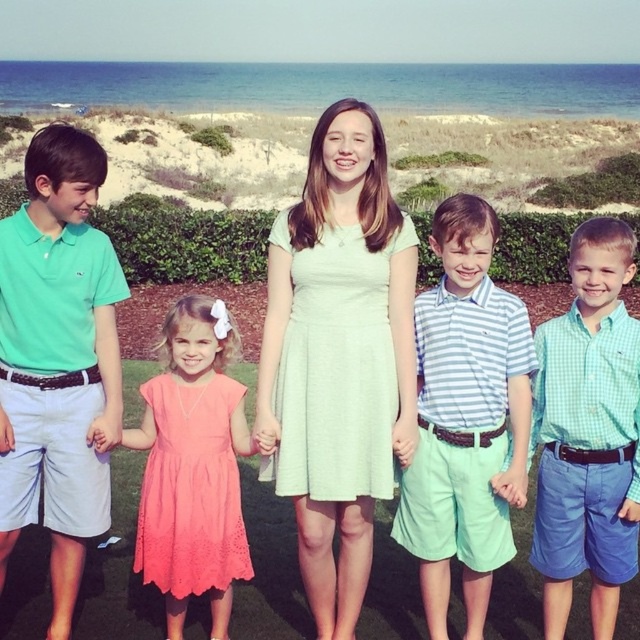
Consider the image. You are a photographer trying to capture a photo of the children holding hands in a line. You notice the green checkered shirt at center and the coral lace dress at center. Which child should you focus on to ensure the other is fully visible in the background?

The photographer should focus on the green checkered shirt at center, as it is in front of the coral lace dress at center, allowing the coral lace dress at center to be visible in the background.

You are a photographer trying to capture a photo of the two central children in the group. The light green dress at center and the striped cotton shirt at center are standing close to each other. Which of the two is taller?

The light green dress at center is taller than the striped cotton shirt at center.

Consider the image. You are a photographer trying to capture the children in the center of the image. You notice the light green dress at center and the green checkered shirt at center. Which one should you focus on if you want to photograph the child who is standing to the left of the other?

The light green dress at center is positioned on the left side of green checkered shirt at center, so you should focus on the light green dress at center to photograph the child standing to the left.